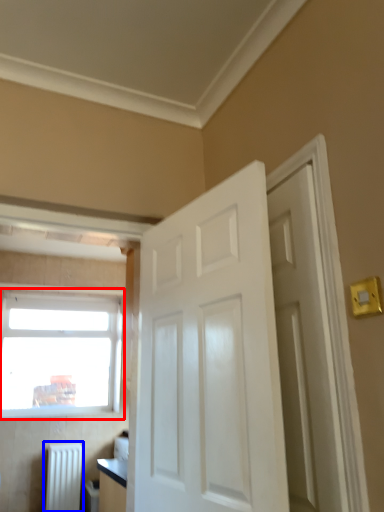
Question: Which point is further to the camera, window (highlighted by a red box) or radiator (highlighted by a blue box)?

Choices:
 (A) window
 (B) radiator

Answer: (A)